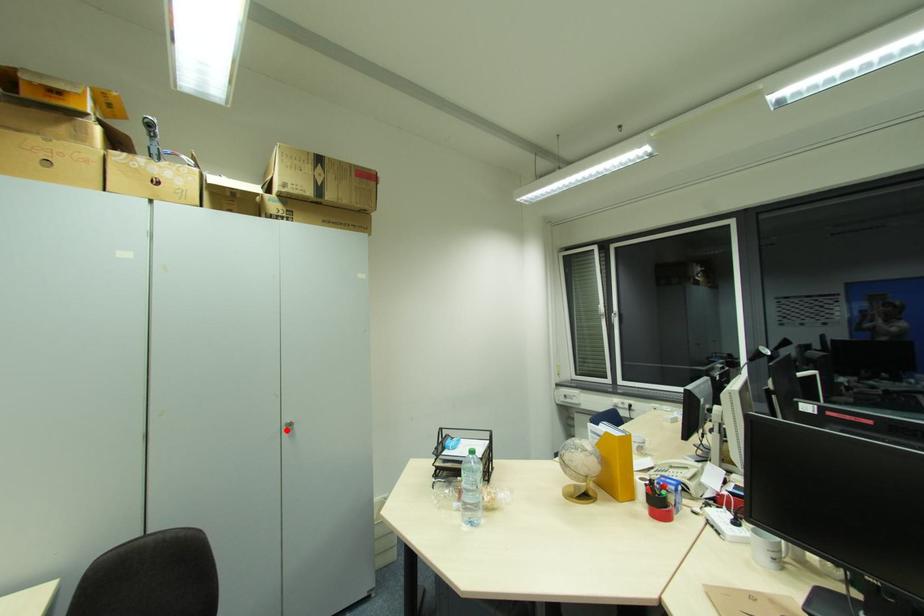
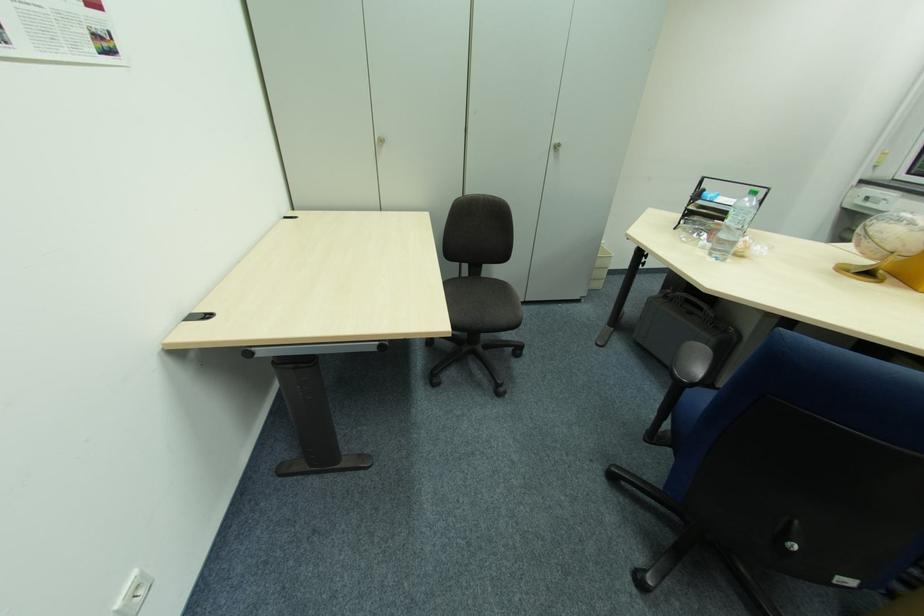
Locate, in the second image, the point that corresponds to the highlighted location in the first image.

(554, 150)